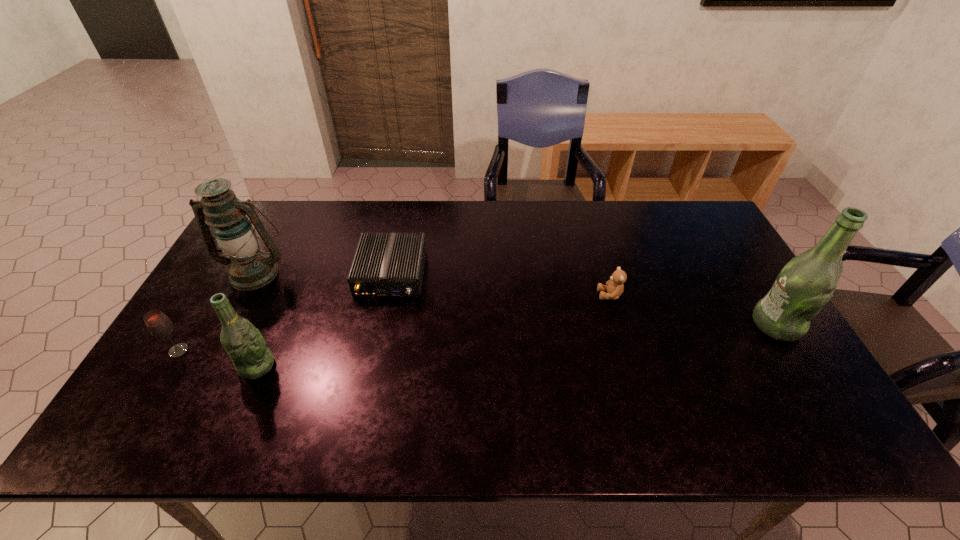
At what (x,y) coordinates should I click in order to perform the action: click on free region located on the surface of the nearer beer bottle. Please return your answer as a coordinate pair (x, y). Looking at the image, I should click on (386, 366).

Image resolution: width=960 pixels, height=540 pixels. I want to click on free location located 0.080m on the back panel of the fourth object from left to right, so click(381, 323).

I want to click on free space located 0.090m on the front-facing side of the second shortest object, so click(567, 295).

I want to click on free space located 0.330m on the front-facing side of the second shortest object, so click(485, 295).

Locate an element on the screen. Image resolution: width=960 pixels, height=540 pixels. vacant region located 0.180m on the front-facing side of the second shortest object is located at coordinates (536, 295).

Locate an element on the screen. Image resolution: width=960 pixels, height=540 pixels. vacant space located on the right of the oil lamp is located at coordinates (320, 273).

Locate an element on the screen. vacant area located 0.060m on the back of the third shortest object is located at coordinates (194, 326).

Image resolution: width=960 pixels, height=540 pixels. I want to click on object located at the near edge, so click(243, 342).

Where is `oil lamp at the left edge`? oil lamp at the left edge is located at coordinates (249, 268).

Locate an element on the screen. glass drink container at the left edge is located at coordinates (158, 324).